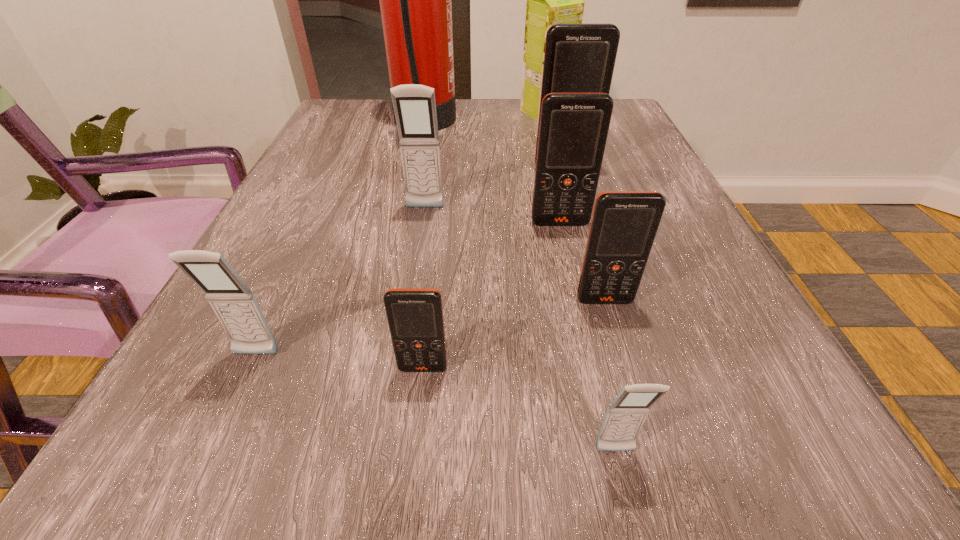
Find the location of a particular element. This screenshot has height=540, width=960. the sixth closest cellular telephone relative to the third nearest object is located at coordinates (579, 58).

Where is `orange cellular telephone that can be found as the closest to the fifth nearest cellular telephone`? Image resolution: width=960 pixels, height=540 pixels. orange cellular telephone that can be found as the closest to the fifth nearest cellular telephone is located at coordinates (579, 58).

Find the location of a particular element. This screenshot has width=960, height=540. orange cellular telephone that can be found as the third closest to the leftmost orange cellular telephone is located at coordinates (579, 58).

Locate an element on the screen. Image resolution: width=960 pixels, height=540 pixels. gray cellular telephone that is the third nearest to the second smallest orange cellular telephone is located at coordinates (236, 307).

Identify which gray cellular telephone is the closest to the rightmost gray cellular telephone. Please provide its 2D coordinates. Your answer should be formatted as a tuple, i.e. [(x, y)], where the tuple contains the x and y coordinates of a point satisfying the conditions above.

[(236, 307)]